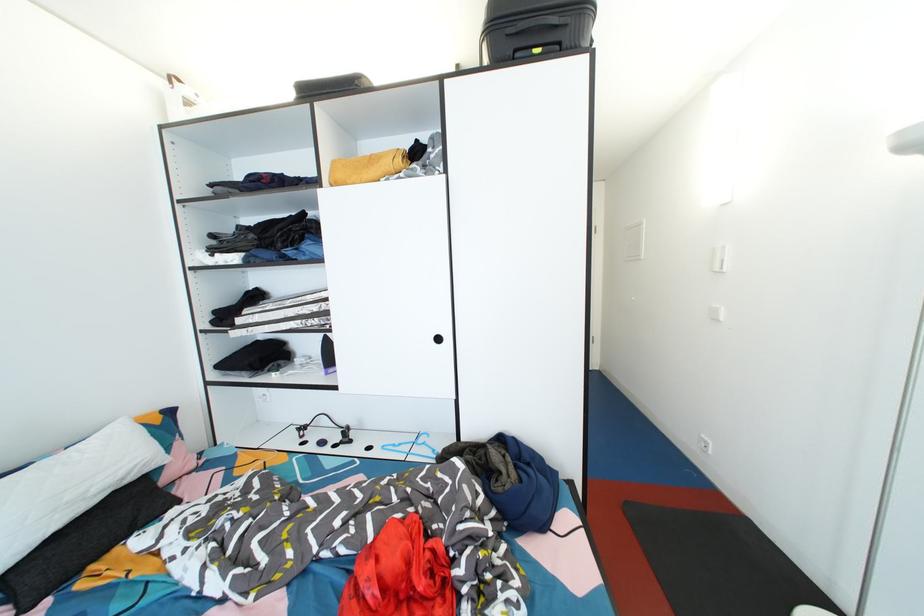
Find the location of a particular element. The width and height of the screenshot is (924, 616). black suitcase handle is located at coordinates (544, 15).